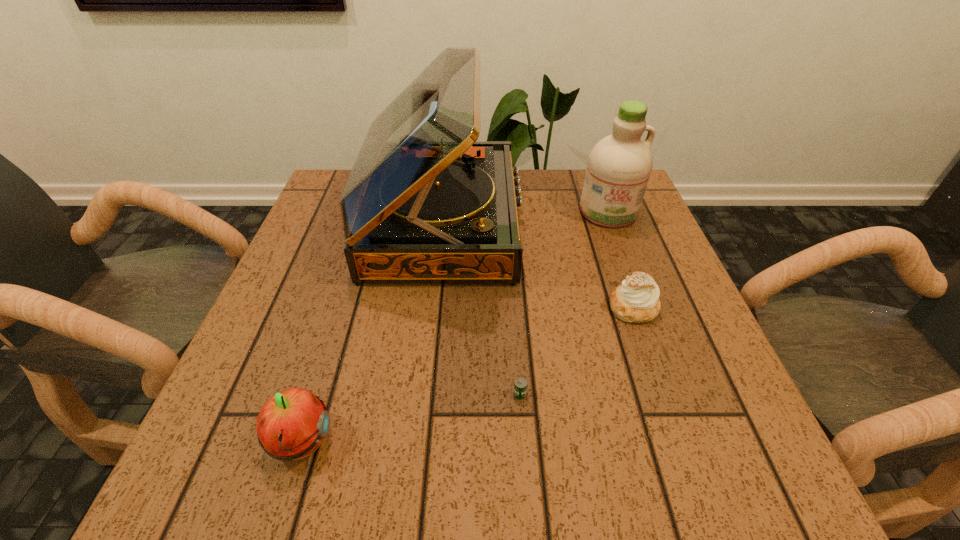
Identify the location of object at the far right corner. The height and width of the screenshot is (540, 960). (619, 166).

In the image, there is a desktop. Identify the location of vacant space at the far edge. This screenshot has width=960, height=540. (568, 187).

The height and width of the screenshot is (540, 960). I want to click on vacant space at the near edge of the desktop, so click(x=401, y=460).

Locate an element on the screen. The image size is (960, 540). free space at the left edge is located at coordinates (290, 288).

Where is `vacant space at the right edge of the desktop`? vacant space at the right edge of the desktop is located at coordinates (645, 383).

The width and height of the screenshot is (960, 540). In order to click on vacant space at the near left corner of the desktop in this screenshot , I will do `click(199, 484)`.

In the image, there is a desktop. Where is `free space at the near right corner`? free space at the near right corner is located at coordinates (734, 476).

Find the location of `free space between the apple and the pastry`. free space between the apple and the pastry is located at coordinates (467, 375).

You are a GUI agent. You are given a task and a screenshot of the screen. Output one action in this format:
    pyautogui.click(x=<x>, y=<y>)
    Task: Click on the unoccupied position between the shortest object and the third farthest object
    The image size is (960, 540).
    Given the screenshot: What is the action you would take?
    pyautogui.click(x=577, y=350)

You are a GUI agent. You are given a task and a screenshot of the screen. Output one action in this format:
    pyautogui.click(x=<x>, y=<y>)
    Task: Click on the free spot between the second shortest object and the second tallest object
    
    Given the screenshot: What is the action you would take?
    pyautogui.click(x=621, y=260)